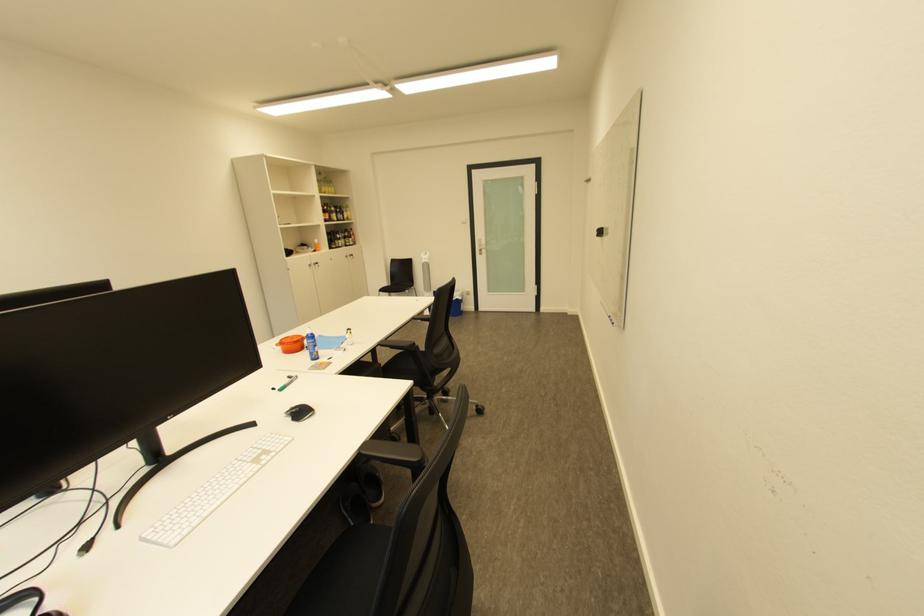
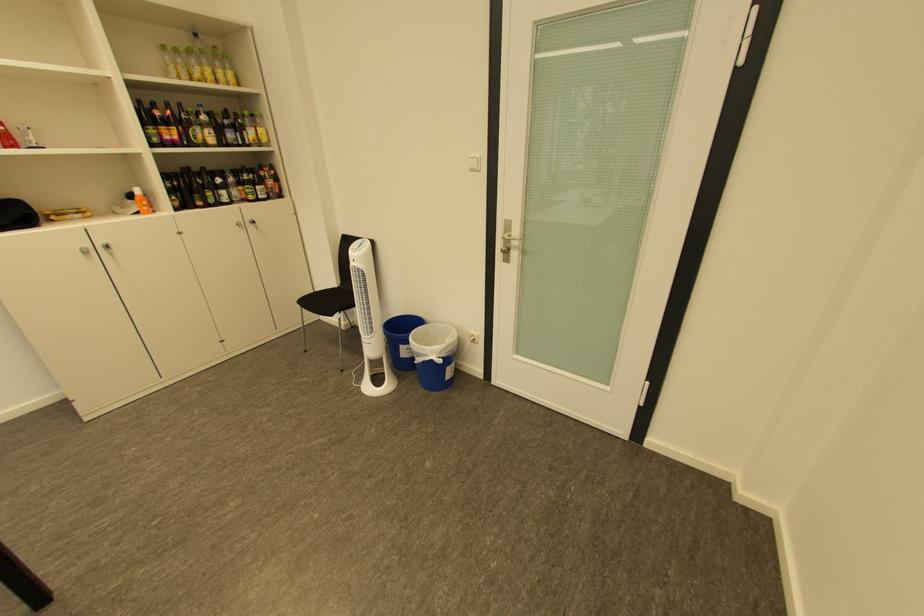
The point at (324, 252) is marked in the first image. Where is the corresponding point in the second image?

(148, 214)